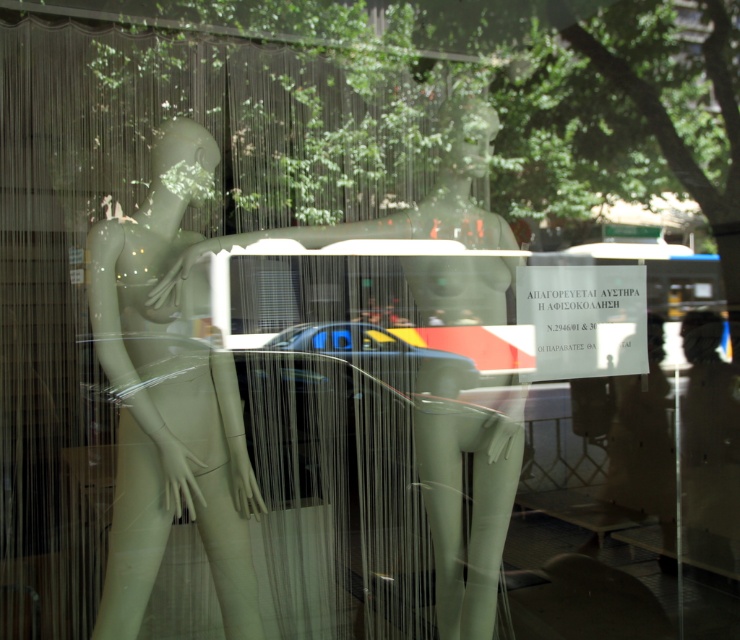
You are a delivery person who needs to place a small package between the matte white mannequin at left and the matte white mannequin at center in the storefront window display. The package is 10 inches wide. Can you fit it between them without moving the mannequins?

The distance between the matte white mannequin at left and the matte white mannequin at center is 12.30 inches. Since the package is 10 inches wide, it can fit between them as there is enough space.

You are a store employee who needs to adjust the height of the two matte white mannequin at left and matte white mannequin at center in the storefront window. According to the current setup, which mannequin is shorter and requires a height adjustment to match the other?

The matte white mannequin at left is shorter compared to the matte white mannequin at center. To match their heights, the left mannequin needs to be raised.